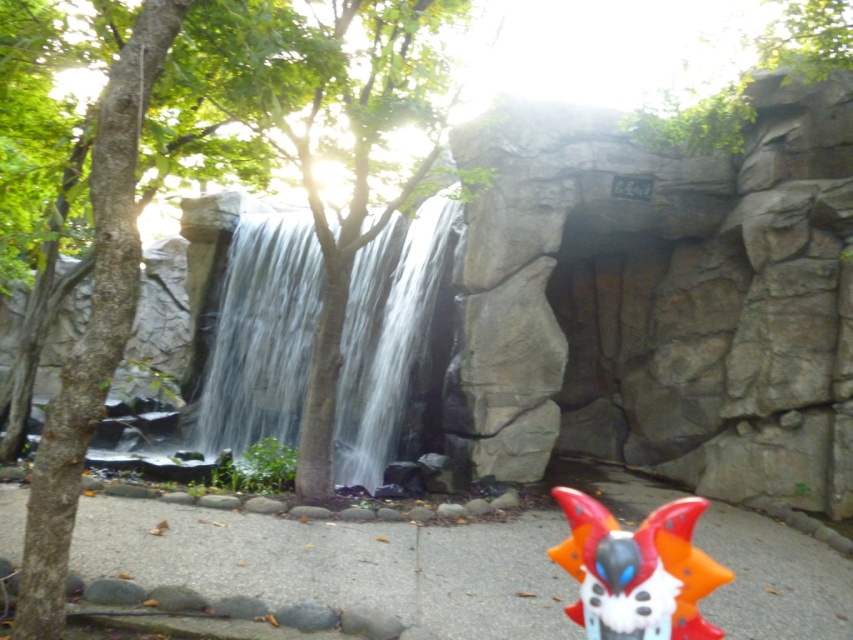
Who is positioned more to the right, clear water at center or orange plastic mask at lower right?

Positioned to the right is orange plastic mask at lower right.

Does clear water at center come behind orange plastic mask at lower right?

Yes, it is behind orange plastic mask at lower right.

Who is more distant from viewer, (401,276) or (694,614)?

Point (401,276)

You are a GUI agent. You are given a task and a screenshot of the screen. Output one action in this format:
    pyautogui.click(x=<x>, y=<y>)
    Task: Click on the clear water at center
    
    Given the screenshot: What is the action you would take?
    pyautogui.click(x=260, y=333)